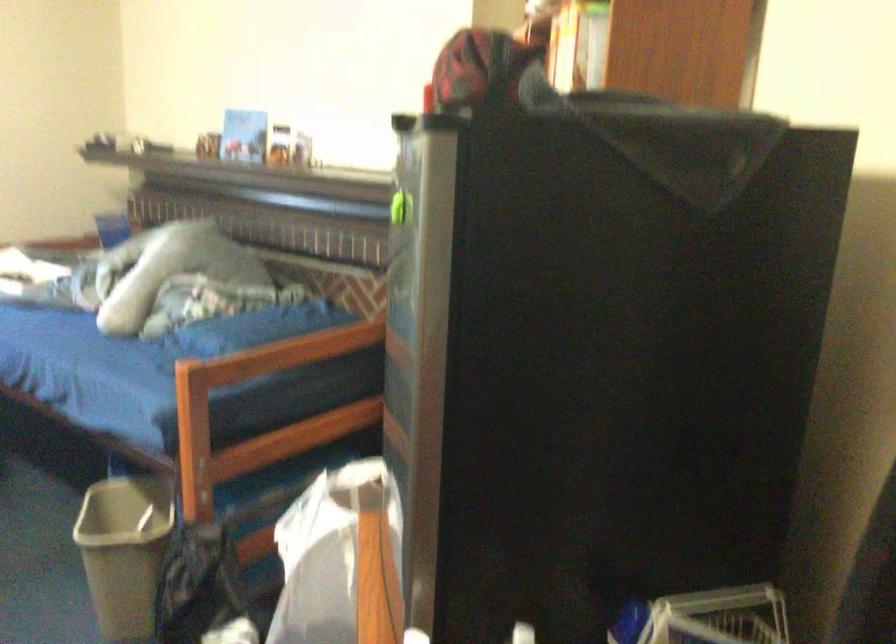
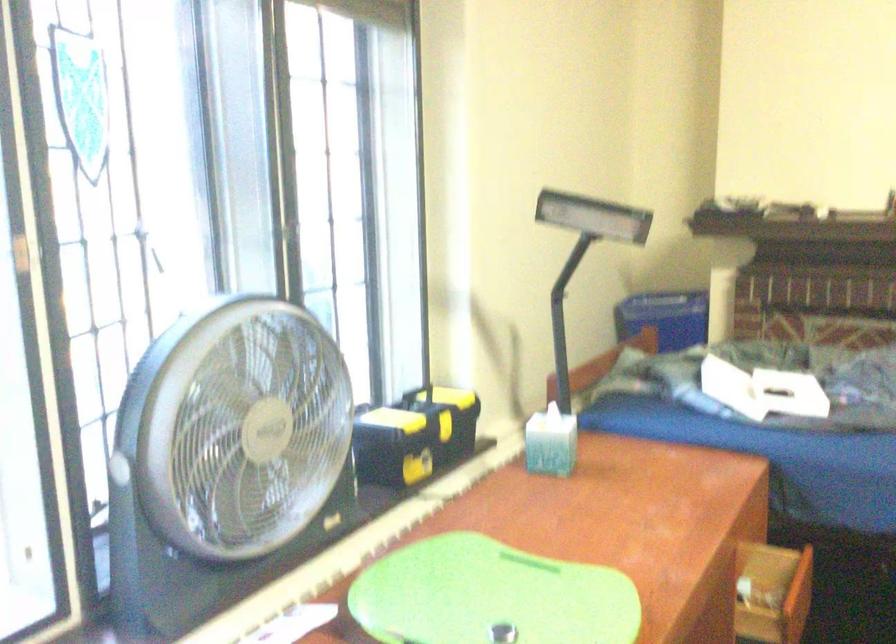
Question: The images are taken continuously from a first-person perspective. In which direction are you moving?

Choices:
 (A) Left
 (B) Right
 (C) Forward
 (D) Backward

Answer: (A)